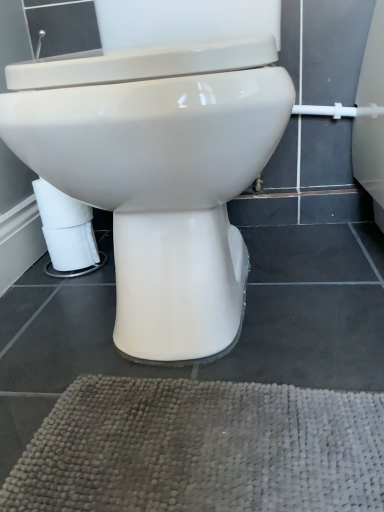
At what (x,y) coordinates should I click in order to perform the action: click on white glossy toilet at center. Please return your answer as a coordinate pair (x, y). This screenshot has width=384, height=512. Looking at the image, I should click on (159, 173).

What do you see at coordinates (159, 173) in the screenshot? I see `white glossy toilet at center` at bounding box center [159, 173].

What is the approximate height of white glossy toilet at center?

It is 56.46 centimeters.

Identify the location of white glossy toilet at center. (159, 173).